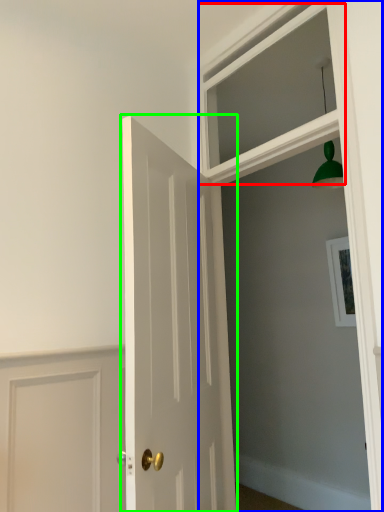
Question: Based on their relative distances, which object is nearer to window (highlighted by a red box)? Choose from window frame (highlighted by a blue box) and door (highlighted by a green box).

Choices:
 (A) window frame
 (B) door

Answer: (A)